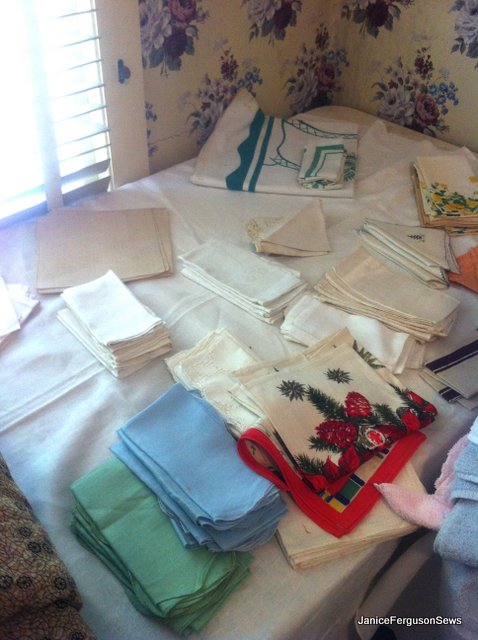
Image resolution: width=478 pixels, height=640 pixels. What are the coordinates of `fabric` in the screenshot? It's located at (50, 570).